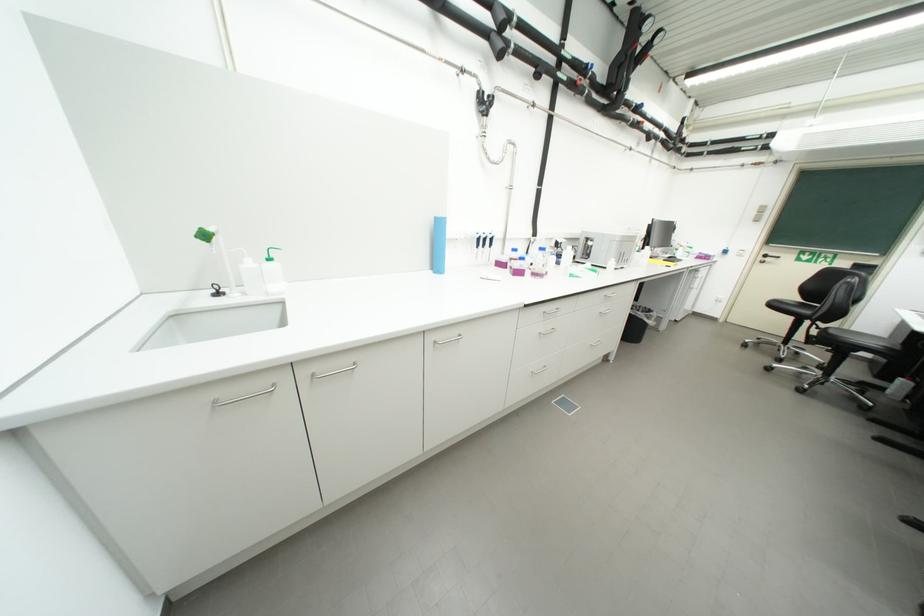
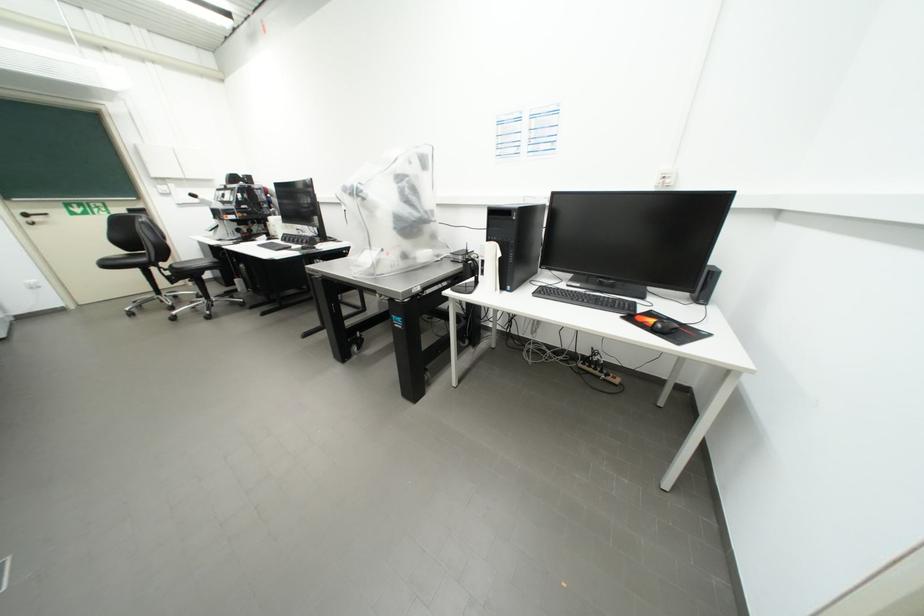
The point at (786, 342) is marked in the first image. Where is the corresponding point in the second image?

(160, 296)